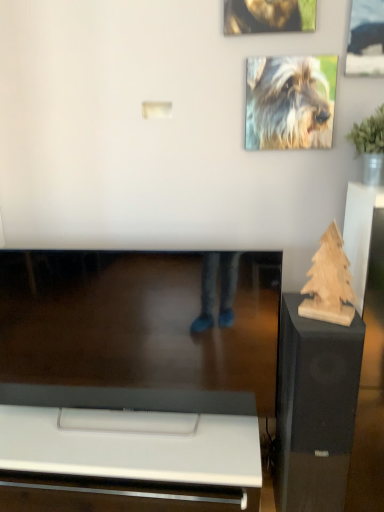
Question: Is shiny golden fur at upper center, which ranks as the second dog in bottom-to-top order, bigger than wooden sculpture at right?

Choices:
 (A) no
 (B) yes

Answer: (A)

Question: Does shiny golden fur at upper center, which ranks as the second dog in bottom-to-top order, come behind wooden sculpture at right?

Choices:
 (A) no
 (B) yes

Answer: (B)

Question: Is wooden sculpture at right completely or partially inside shiny golden fur at upper center, which ranks as the second dog in bottom-to-top order?

Choices:
 (A) no
 (B) yes

Answer: (A)

Question: From the image's perspective, is shiny golden fur at upper center, which ranks as the second dog in bottom-to-top order, located beneath wooden sculpture at right?

Choices:
 (A) no
 (B) yes

Answer: (A)

Question: Considering the relative positions of shiny golden fur at upper center, marked as the 1th dog in a top-to-bottom arrangement, and wooden sculpture at right in the image provided, is shiny golden fur at upper center, marked as the 1th dog in a top-to-bottom arrangement, to the right of wooden sculpture at right from the viewer's perspective?

Choices:
 (A) yes
 (B) no

Answer: (B)

Question: Is point (324, 494) positioned closer to the camera than point (261, 31)?

Choices:
 (A) farther
 (B) closer

Answer: (B)

Question: From a real-world perspective, is wooden sculpture at right physically located above or below shiny golden fur at upper center, marked as the 1th dog in a top-to-bottom arrangement?

Choices:
 (A) below
 (B) above

Answer: (A)

Question: Considering the positions of wooden sculpture at right and shiny golden fur at upper center, marked as the 1th dog in a top-to-bottom arrangement, in the image, is wooden sculpture at right taller or shorter than shiny golden fur at upper center, marked as the 1th dog in a top-to-bottom arrangement,?

Choices:
 (A) tall
 (B) short

Answer: (A)

Question: Which is correct: wooden sculpture at right is inside shiny golden fur at upper center, marked as the 1th dog in a top-to-bottom arrangement, or outside of it?

Choices:
 (A) outside
 (B) inside

Answer: (A)

Question: From the image's perspective, is shiny golden fur at upper center, which ranks as the second dog in bottom-to-top order, positioned above or below fluffy fur dog at upper right, which is counted as the first dog, starting from the bottom?

Choices:
 (A) below
 (B) above

Answer: (B)

Question: Do you think shiny golden fur at upper center, which ranks as the second dog in bottom-to-top order, is within fluffy fur dog at upper right, which is counted as the first dog, starting from the bottom, or outside of it?

Choices:
 (A) outside
 (B) inside

Answer: (A)

Question: From their relative heights in the image, would you say shiny golden fur at upper center, which ranks as the second dog in bottom-to-top order, is taller or shorter than fluffy fur dog at upper right, which is counted as the first dog, starting from the bottom?

Choices:
 (A) tall
 (B) short

Answer: (A)

Question: In the image, is shiny golden fur at upper center, which ranks as the second dog in bottom-to-top order, positioned in front of or behind fluffy fur dog at upper right, marked as the second dog in a top-to-bottom arrangement?

Choices:
 (A) behind
 (B) front

Answer: (B)

Question: Considering the positions of point (331, 434) and point (309, 70), is point (331, 434) closer or farther from the camera than point (309, 70)?

Choices:
 (A) closer
 (B) farther

Answer: (A)

Question: Considering the positions of wooden sculpture at right and fluffy fur dog at upper right, marked as the second dog in a top-to-bottom arrangement, in the image, is wooden sculpture at right bigger or smaller than fluffy fur dog at upper right, marked as the second dog in a top-to-bottom arrangement,?

Choices:
 (A) big
 (B) small

Answer: (A)